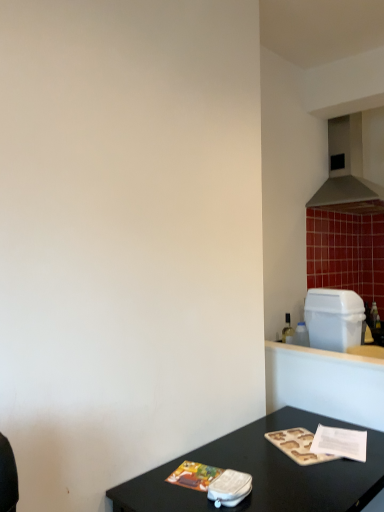
Question: Is metallic gray exhaust hood at upper right directly adjacent to white plastic trash can at right?

Choices:
 (A) no
 (B) yes

Answer: (A)

Question: Are metallic gray exhaust hood at upper right and white plastic trash can at right far apart?

Choices:
 (A) yes
 (B) no

Answer: (A)

Question: Is metallic gray exhaust hood at upper right taller than white plastic trash can at right?

Choices:
 (A) yes
 (B) no

Answer: (A)

Question: From a real-world perspective, is metallic gray exhaust hood at upper right located beneath white plastic trash can at right?

Choices:
 (A) no
 (B) yes

Answer: (A)

Question: From a real-world perspective, is metallic gray exhaust hood at upper right located higher than white plastic trash can at right?

Choices:
 (A) no
 (B) yes

Answer: (B)

Question: Is white plastic trash can at right taller or shorter than black glossy table at lower right?

Choices:
 (A) short
 (B) tall

Answer: (A)

Question: Is point (314, 334) closer or farther from the camera than point (334, 501)?

Choices:
 (A) farther
 (B) closer

Answer: (A)

Question: From the image's perspective, is white plastic trash can at right positioned above or below black glossy table at lower right?

Choices:
 (A) above
 (B) below

Answer: (A)

Question: Is white plastic trash can at right situated inside black glossy table at lower right or outside?

Choices:
 (A) inside
 (B) outside

Answer: (B)

Question: Does point (357, 157) appear closer or farther from the camera than point (314, 298)?

Choices:
 (A) farther
 (B) closer

Answer: (A)

Question: Is metallic gray exhaust hood at upper right spatially inside white plastic trash can at right, or outside of it?

Choices:
 (A) inside
 (B) outside

Answer: (B)

Question: Looking at the image, does metallic gray exhaust hood at upper right seem bigger or smaller compared to white plastic trash can at right?

Choices:
 (A) small
 (B) big

Answer: (B)

Question: From the image's perspective, is metallic gray exhaust hood at upper right above or below white plastic trash can at right?

Choices:
 (A) above
 (B) below

Answer: (A)

Question: Is metallic gray exhaust hood at upper right bigger or smaller than black glossy table at lower right?

Choices:
 (A) small
 (B) big

Answer: (B)

Question: From the image's perspective, relative to black glossy table at lower right, is metallic gray exhaust hood at upper right above or below?

Choices:
 (A) above
 (B) below

Answer: (A)